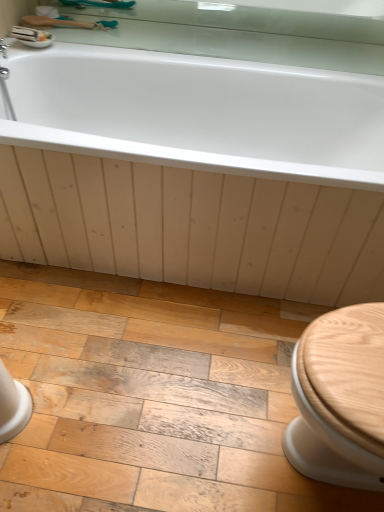
At what (x,y) coordinates should I click in order to perform the action: click on vacant space to the right of wooden brush at upper left. Please return your answer as a coordinate pair (x, y). Looking at the image, I should click on (135, 36).